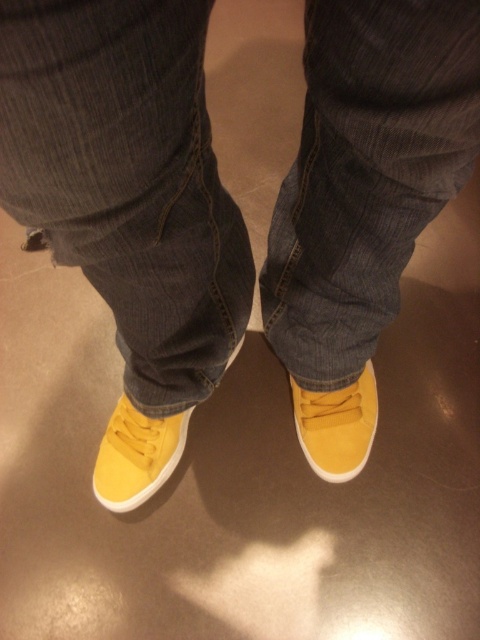
Is matte yellow sneaker at lower left further to the viewer compared to yellow suede shoe at lower center?

No, it is not.

Does point (142, 490) come closer to viewer compared to point (313, 444)?

Yes.

Is point (168, 449) positioned before point (354, 444)?

That is False.

I want to click on matte yellow sneaker at lower left, so (136, 456).

Describe the element at coordinates (128, 179) in the screenshot. The height and width of the screenshot is (640, 480). I see `denim at center` at that location.

Consider the image. Can you confirm if denim at center is smaller than yellow suede shoe at lower center?

No.

Does point (50, 124) lie behind point (361, 432)?

No, it is not.

Identify the location of denim at center. Image resolution: width=480 pixels, height=640 pixels. (128, 179).

Who is more distant from viewer, [74,115] or [142,502]?

The point [142,502] is more distant.

Looking at this image, who is lower down, denim at center or matte yellow sneaker at lower left?

Positioned lower is matte yellow sneaker at lower left.

Image resolution: width=480 pixels, height=640 pixels. In order to click on denim at center in this screenshot , I will do `click(128, 179)`.

You are a GUI agent. You are given a task and a screenshot of the screen. Output one action in this format:
    pyautogui.click(x=<x>, y=<y>)
    Task: Click on the denim at center
    This screenshot has height=640, width=480.
    Given the screenshot: What is the action you would take?
    pyautogui.click(x=128, y=179)